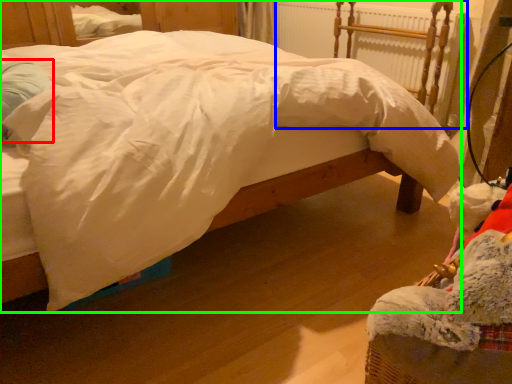
Question: Considering the real-world distances, which object is closest to pillow (highlighted by a red box)? radiator (highlighted by a blue box) or bed (highlighted by a green box).

Choices:
 (A) radiator
 (B) bed

Answer: (B)